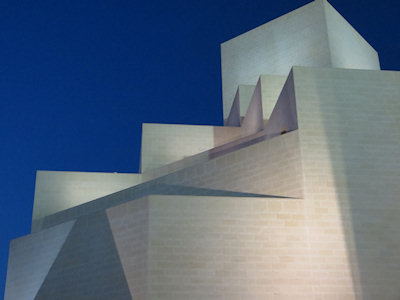
The height and width of the screenshot is (300, 400). I want to click on front ledge, so click(132, 201).